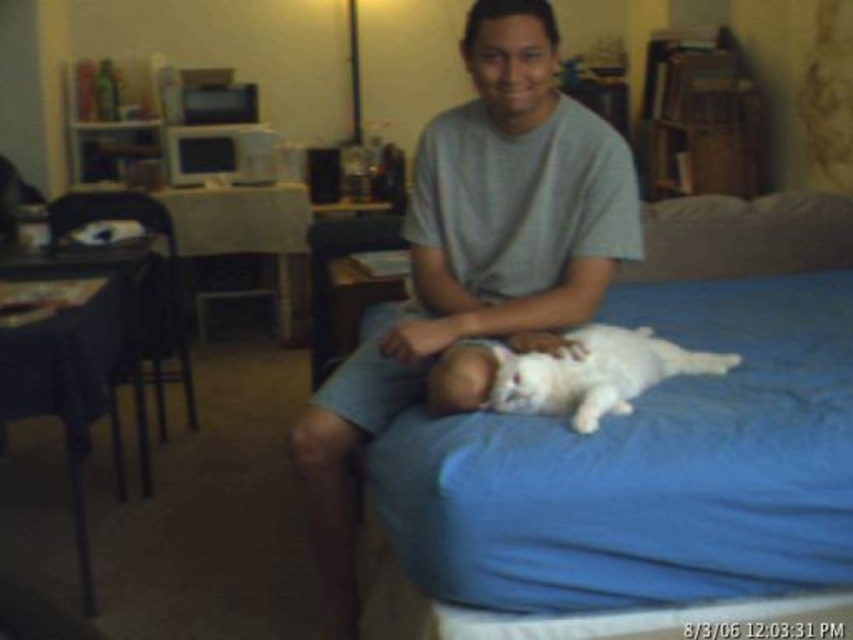
You are a delivery person who needs to place a small package on the blue fabric bed at center without disturbing the white soft baby at center. Can you do this based on their positions?

The blue fabric bed at center is located above the white soft baby at center, so you can place the package on the bed without disturbing the baby since they are positioned below.

You are standing at the entrance of the bedroom and want to reach the blue fabric bed at center. What is the shortest path you can take without crossing any obstacles?

The shortest path to the blue fabric bed at center would be to move directly towards the coordinates where it is located at point (645, 445), avoiding any obstacles in the room such as the desk, chair, and scattered items. Since the bed is at the center, moving straight ahead from the entrance should lead you there without needing to navigate around many objects.

You are a photographer taking a picture of the gray cotton shirt at center and the white soft baby at center. Which one is covering the other in the image?

The gray cotton shirt at center is positioned over white soft baby at center, so it is covering it.